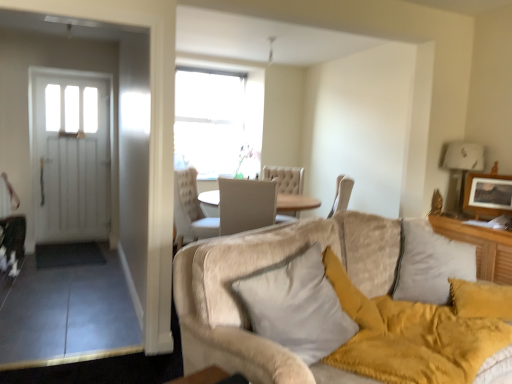
Question: From a real-world perspective, is white soft pillow at center positioned above or below wooden picture frame at upper right?

Choices:
 (A) above
 (B) below

Answer: (B)

Question: Is point (293, 342) positioned closer to the camera than point (495, 201)?

Choices:
 (A) closer
 (B) farther

Answer: (A)

Question: Which of these objects is positioned closest to the white soft pillow at center?

Choices:
 (A) wooden picture frame at upper right
 (B) beige plush couch at lower right

Answer: (B)

Question: Based on their relative distances, which object is farther from the beige plush couch at lower right?

Choices:
 (A) white soft pillow at center
 (B) wooden picture frame at upper right

Answer: (B)